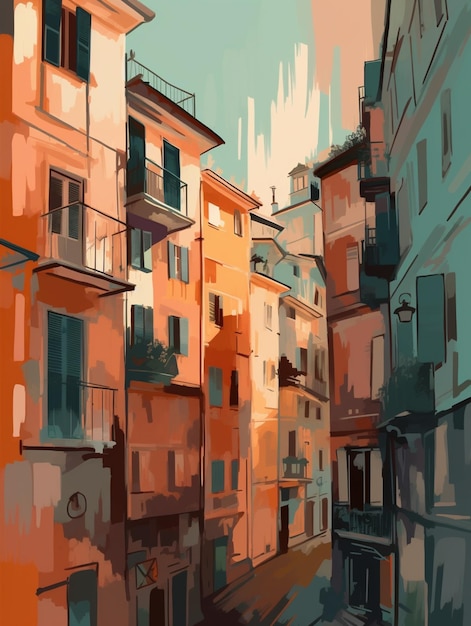
Identify the location of lamp. This screenshot has width=471, height=626. (406, 310).